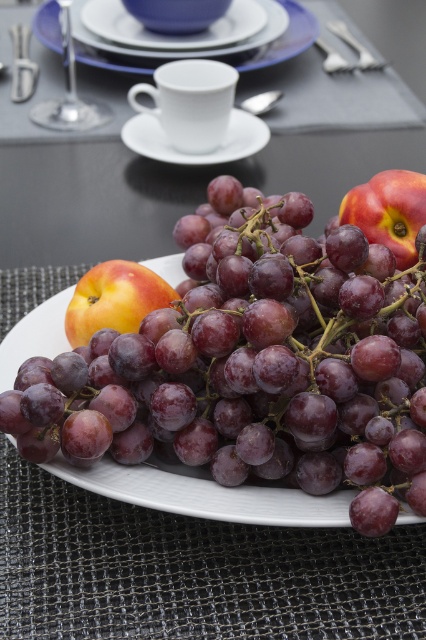
You are setting up a table for a tea party and need to place the shiny purple grapes at center and the white ceramic saucer at center. According to the image, where should you position the grapes relative to the saucer?

The shiny purple grapes at center should be placed below the white ceramic saucer at center as per the image.